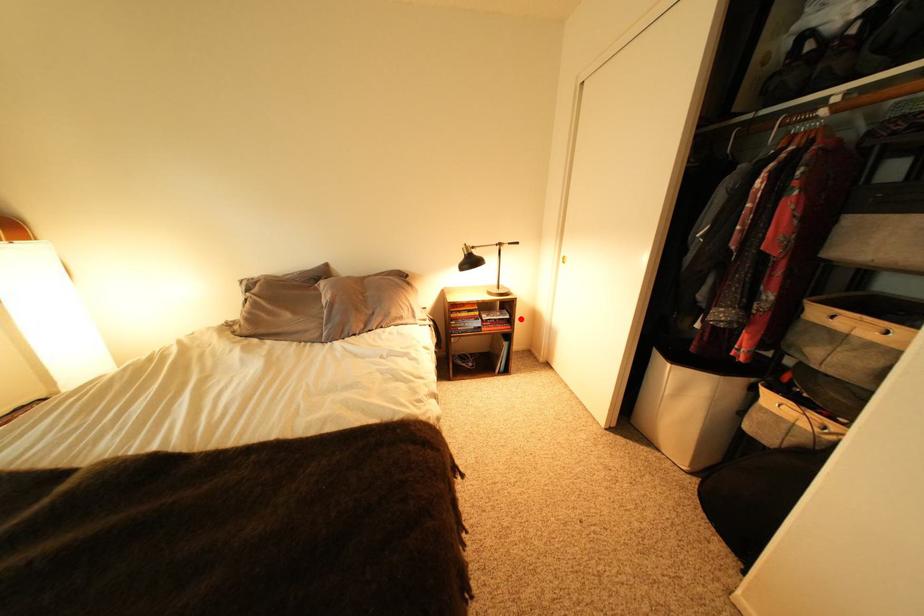
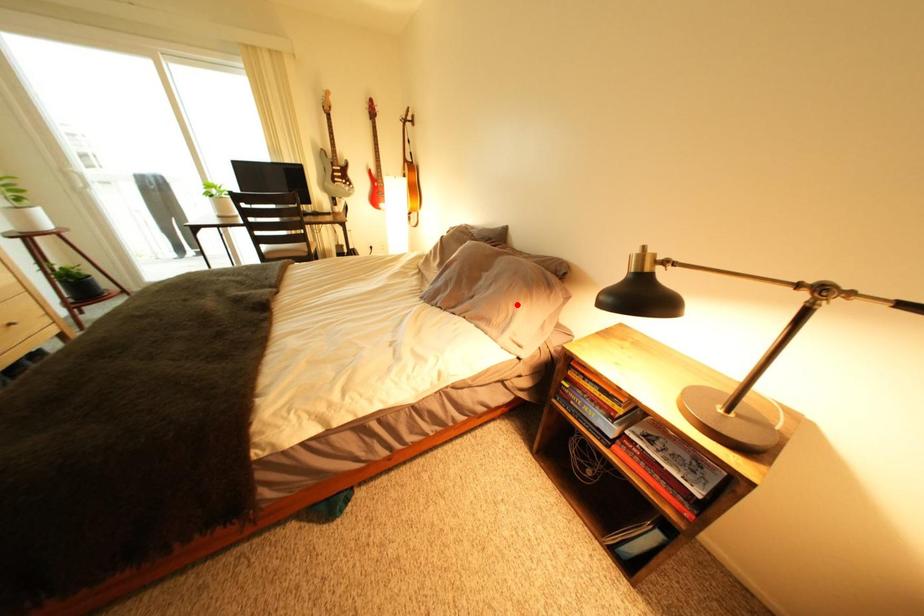
I am providing you with two images of the same scene from different viewpoints. A red point is marked on the first image and another point is marked on the second image. Does the point marked in image1 correspond to the same location as the one in image2?

No